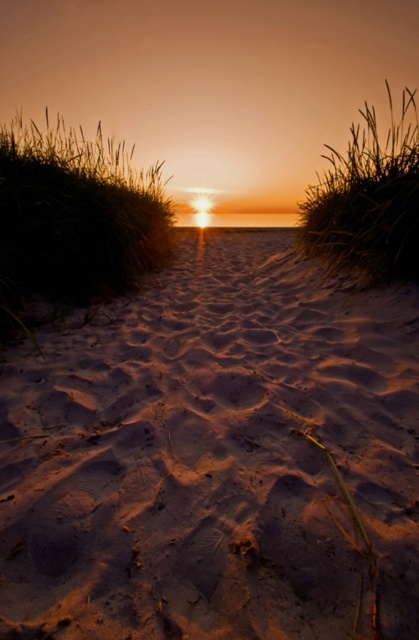
Can you confirm if silvery grass at left is shorter than silvery grass at upper right?

Incorrect, silvery grass at left's height does not fall short of silvery grass at upper right's.

Can you confirm if silvery grass at left is positioned to the right of silvery grass at upper right?

In fact, silvery grass at left is to the left of silvery grass at upper right.

Does point (67, 180) come behind point (377, 228)?

Yes, it is behind point (377, 228).

Locate an element on the screen. The image size is (419, 640). silvery grass at left is located at coordinates (74, 218).

Is the position of sandy textured path at center less distant than that of silvery grass at left?

Yes, sandy textured path at center is in front of silvery grass at left.

Find the location of a particular element. Image resolution: width=419 pixels, height=640 pixels. sandy textured path at center is located at coordinates (214, 456).

I want to click on sandy textured path at center, so click(214, 456).

Measure the distance between sandy textured path at center and camera.

1.53 meters

Does sandy textured path at center appear on the left side of silvery grass at upper right?

Indeed, sandy textured path at center is positioned on the left side of silvery grass at upper right.

Where is `sandy textured path at center`? The image size is (419, 640). sandy textured path at center is located at coordinates (214, 456).

Image resolution: width=419 pixels, height=640 pixels. I want to click on sandy textured path at center, so click(x=214, y=456).